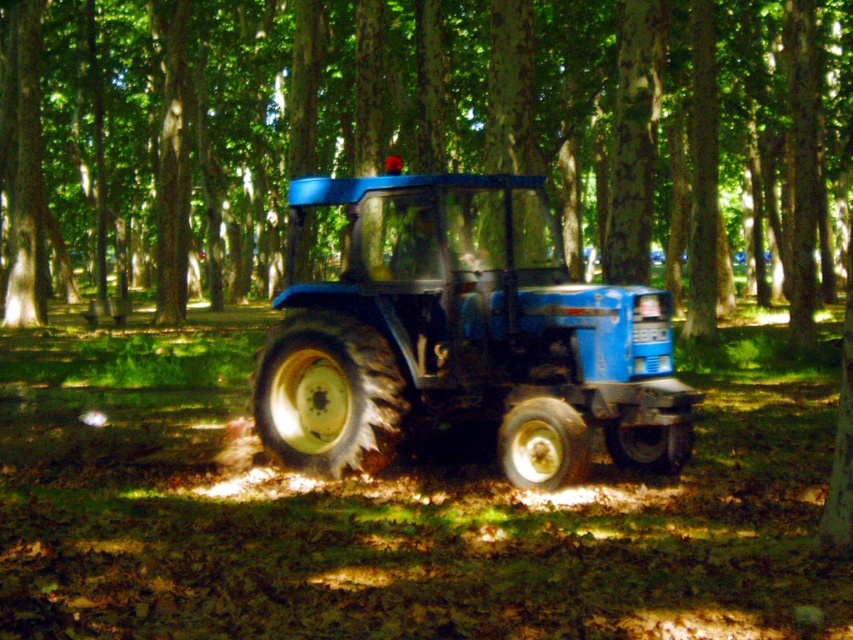
Question: Is matte blue tractor at center in front of blue matte tractor at center?

Choices:
 (A) no
 (B) yes

Answer: (B)

Question: Which point is farther to the camera?

Choices:
 (A) (289, 330)
 (B) (383, 86)

Answer: (B)

Question: Does matte blue tractor at center appear on the left side of blue matte tractor at center?

Choices:
 (A) yes
 (B) no

Answer: (B)

Question: In this image, where is matte blue tractor at center located relative to blue matte tractor at center?

Choices:
 (A) right
 (B) left

Answer: (A)

Question: Which point is closer to the camera?

Choices:
 (A) blue matte tractor at center
 (B) matte blue tractor at center

Answer: (B)